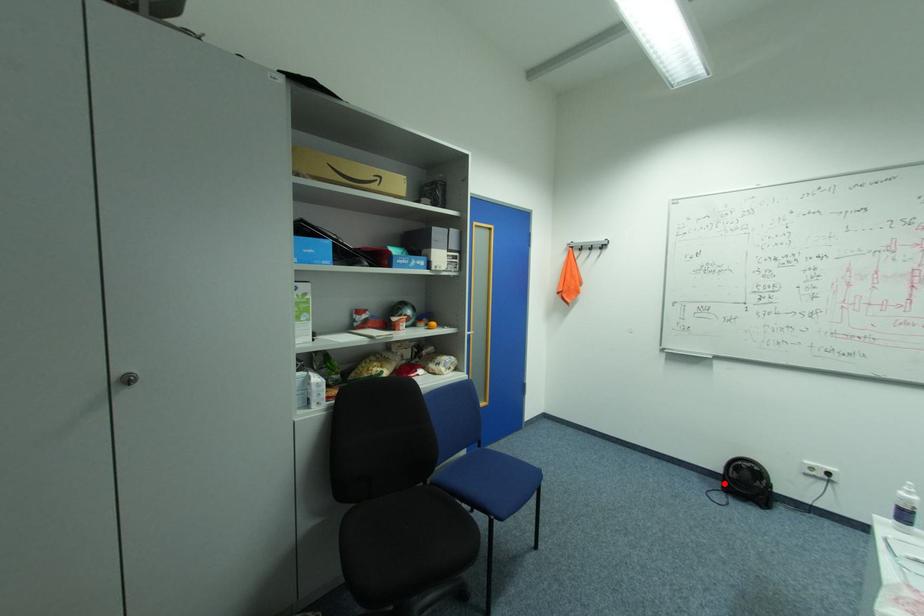
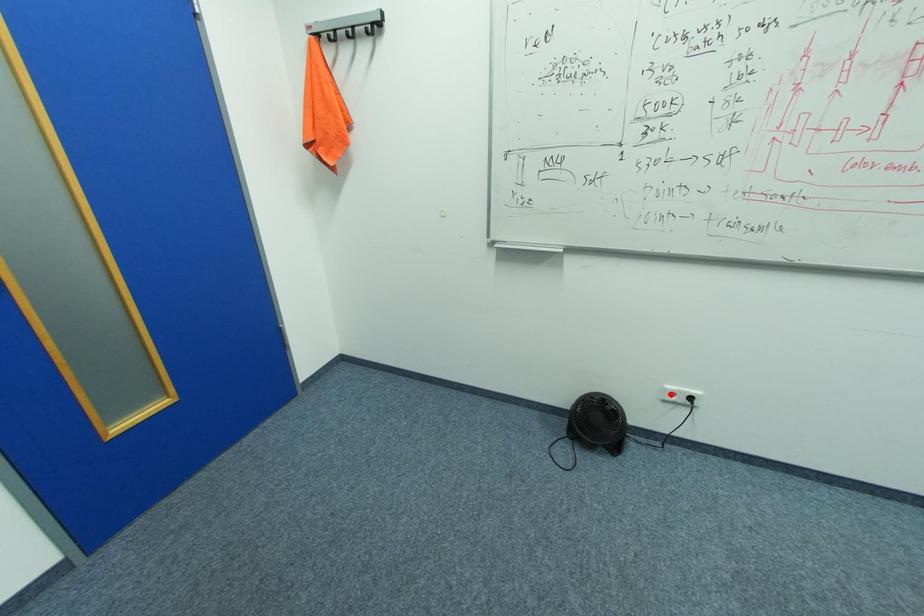
From the picture: I am providing you with two images of the same scene from different viewpoints. A red point is marked on the first image and another point is marked on the second image. Is the marked point in image1 the same physical position as the marked point in image2?

No